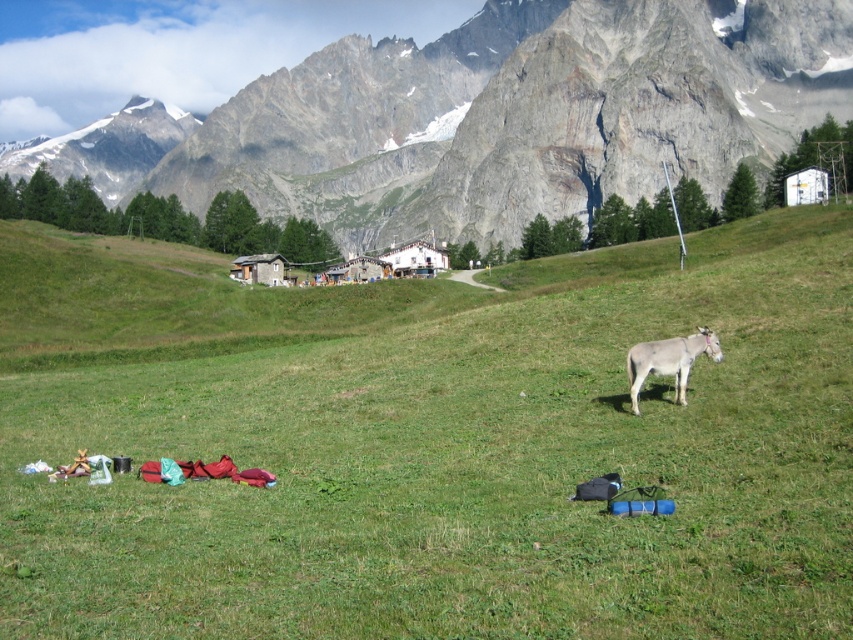
Is point (318, 221) farther from viewer compared to point (701, 349)?

Yes, it is behind point (701, 349).

Is rocky gray mountain at upper center to the left of white matte donkey at right from the viewer's perspective?

Yes, rocky gray mountain at upper center is to the left of white matte donkey at right.

Is point (230, 109) farther from viewer compared to point (654, 344)?

Yes, it is.

Image resolution: width=853 pixels, height=640 pixels. Find the location of `rocky gray mountain at upper center`. rocky gray mountain at upper center is located at coordinates (514, 115).

Which is more to the left, green grass pasture at center or rocky gray mountain at upper center?

rocky gray mountain at upper center is more to the left.

Who is lower down, green grass pasture at center or rocky gray mountain at upper center?

green grass pasture at center

The height and width of the screenshot is (640, 853). In order to click on green grass pasture at center in this screenshot , I will do `click(438, 448)`.

Between point (782, 490) and point (712, 342), which one is positioned behind?

Point (712, 342)

Can you confirm if green grass pasture at center is bigger than white matte donkey at right?

Indeed, green grass pasture at center has a larger size compared to white matte donkey at right.

Find the location of `green grass pasture at center`. green grass pasture at center is located at coordinates (438, 448).